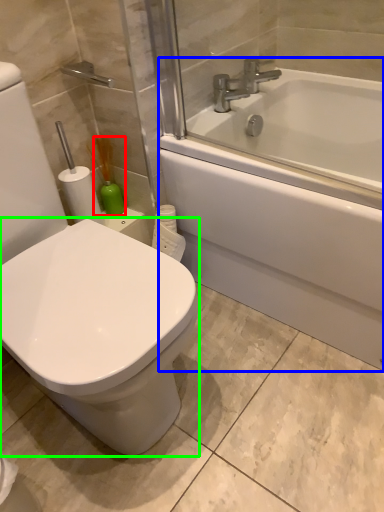
Question: Estimate the real-world distances between objects in this image. Which object is closer to soap dispenser (highlighted by a red box), bathtub (highlighted by a blue box) or bidet (highlighted by a green box)?

Choices:
 (A) bathtub
 (B) bidet

Answer: (A)